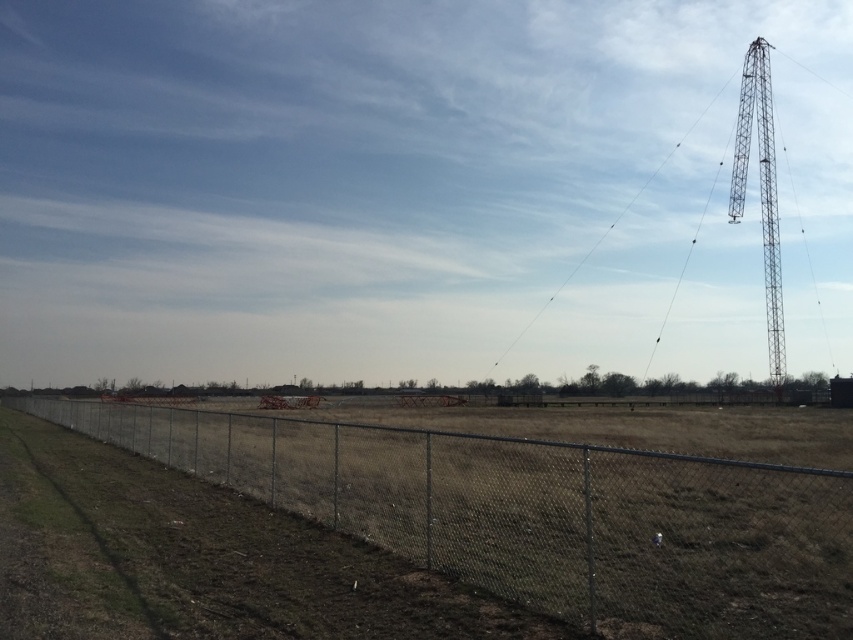
Question: Is metal chain-link fence at lower left above metallic lattice tower at right?

Choices:
 (A) yes
 (B) no

Answer: (B)

Question: Does metal chain-link fence at lower left appear on the right side of metallic wire at upper right?

Choices:
 (A) no
 (B) yes

Answer: (A)

Question: Can you confirm if metal chain-link fence at lower left is smaller than metallic wire at upper right?

Choices:
 (A) yes
 (B) no

Answer: (A)

Question: Which of these objects is positioned farthest from the metallic wire at upper right?

Choices:
 (A) metal chain-link fence at lower left
 (B) metallic lattice tower at right

Answer: (A)

Question: Which of the following is the farthest from the observer?

Choices:
 (A) metallic lattice tower at right
 (B) metal chain-link fence at lower left

Answer: (A)

Question: Which point is closer to the camera?

Choices:
 (A) (740, 122)
 (B) (521, 328)

Answer: (A)